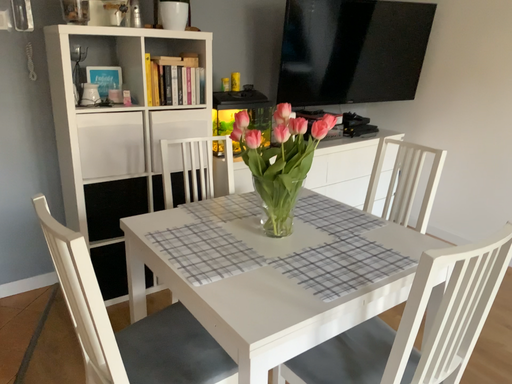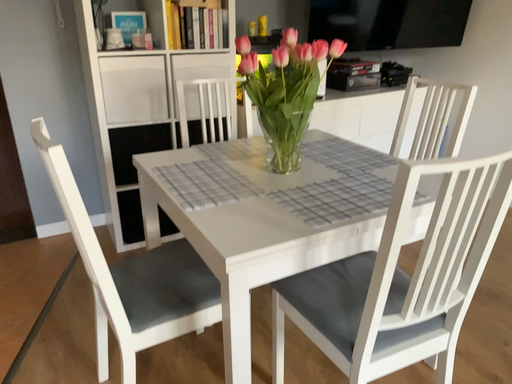
Question: Which way did the camera rotate in the video?

Choices:
 (A) rotated right
 (B) rotated left

Answer: (B)